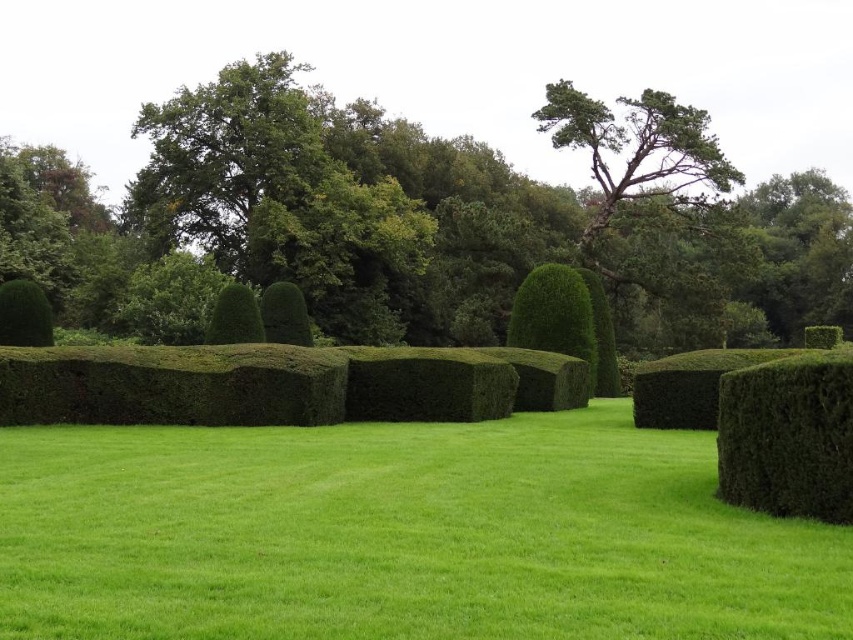
Question: Can you confirm if green smooth grass at center is thinner than green leafy tree at center?

Choices:
 (A) no
 (B) yes

Answer: (B)

Question: Which object is farther from the camera taking this photo?

Choices:
 (A) dark green textured hedge at lower right
 (B) green smooth grass at center
 (C) green leafy tree at center

Answer: (C)

Question: Which object is positioned farthest from the green leafy shrub at left?

Choices:
 (A) green smooth grass at center
 (B) dark green textured hedge at lower right
 (C) green leafy tree at center

Answer: (C)

Question: Considering the relative positions of green smooth grass at center and green leafy shrub at left in the image provided, where is green smooth grass at center located with respect to green leafy shrub at left?

Choices:
 (A) right
 (B) left

Answer: (A)

Question: Is green smooth grass at center to the left of green leafy tree at center from the viewer's perspective?

Choices:
 (A) no
 (B) yes

Answer: (A)

Question: Which object appears farthest from the camera in this image?

Choices:
 (A) green leafy tree at center
 (B) green leafy shrub at left
 (C) dark green textured hedge at lower right

Answer: (A)